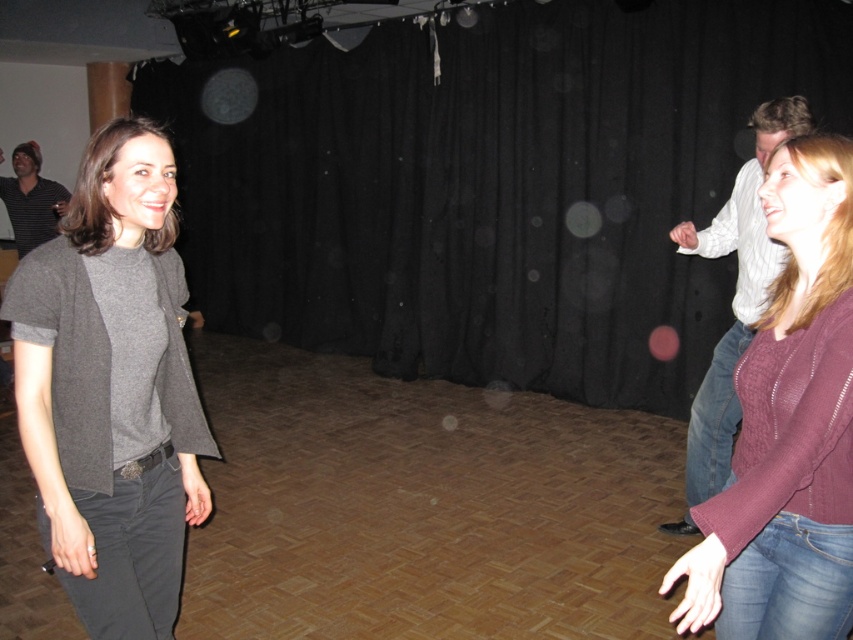
Question: Which of the following is the closest to the observer?

Choices:
 (A) (621, 358)
 (B) (759, 172)

Answer: (B)

Question: Is white striped shirt at right to the right of striped cotton shirt at left from the viewer's perspective?

Choices:
 (A) yes
 (B) no

Answer: (A)

Question: Based on their relative distances, which object is farther from the black matte curtain at center?

Choices:
 (A) dark gray cotton jeans at lower left
 (B) jeans at lower right
 (C) jeans at right

Answer: (A)

Question: Is black matte curtain at center further to camera compared to jeans at lower right?

Choices:
 (A) yes
 (B) no

Answer: (A)

Question: Among these points, which one is farthest from the camera?

Choices:
 (A) coord(144,490)
 (B) coord(737,557)
 (C) coord(103,180)
 (D) coord(55,230)

Answer: (D)

Question: Can you confirm if black matte curtain at center is bigger than striped cotton shirt at left?

Choices:
 (A) yes
 (B) no

Answer: (A)